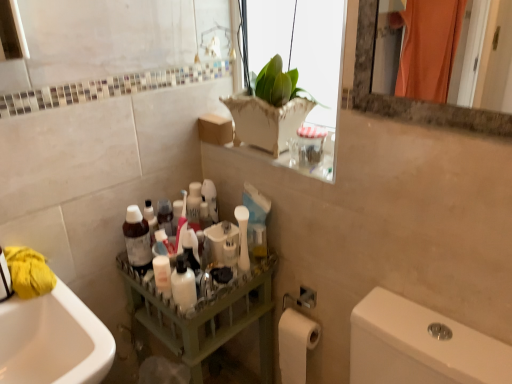
The image size is (512, 384). Find the location of `white glossy bottle at center`. white glossy bottle at center is located at coordinates (183, 284).

Measure the distance between point (239, 134) and camera.

Point (239, 134) is 1.35 meters from camera.

Image resolution: width=512 pixels, height=384 pixels. Describe the element at coordinates (293, 77) in the screenshot. I see `white ceramic vase at upper center` at that location.

What do you see at coordinates (295, 344) in the screenshot? The width and height of the screenshot is (512, 384). I see `white matte toilet paper at lower right` at bounding box center [295, 344].

Identify the location of white matte toilet paper at lower right. The image size is (512, 384). (295, 344).

Where is `white matte toothbrush at center`? The height and width of the screenshot is (384, 512). white matte toothbrush at center is located at coordinates (243, 237).

What is the approximate height of white matte toothbrush at center?

It is 20.59 centimeters.

This screenshot has width=512, height=384. What are the coordinates of `matte plastic bottle at center` in the screenshot? It's located at (x=137, y=240).

Considering the sizes of objects white glossy bottle at center and yellow fabric at left in the image provided, who is smaller, white glossy bottle at center or yellow fabric at left?

With smaller size is white glossy bottle at center.

Is white glossy bottle at center positioned with its back to yellow fabric at left?

white glossy bottle at center does not have its back to yellow fabric at left.

Is the position of white glossy bottle at center less distant than that of yellow fabric at left?

No, it is behind yellow fabric at left.

From the picture: In the image, is yellow fabric at left on the left side or the right side of matte plastic bottle at center?

Based on their positions, yellow fabric at left is located to the left of matte plastic bottle at center.

Would you say yellow fabric at left is a long distance from matte plastic bottle at center?

No, yellow fabric at left is not far from matte plastic bottle at center.

In the scene shown: Is yellow fabric at left oriented away from matte plastic bottle at center?

No, yellow fabric at left's orientation is not away from matte plastic bottle at center.

Looking at their sizes, would you say yellow fabric at left is wider or thinner than matte plastic bottle at center?

In the image, yellow fabric at left appears to be wider than matte plastic bottle at center.

Choose the correct answer: Is white matte toothbrush at center inside yellow fabric at left or outside it?

white matte toothbrush at center cannot be found inside yellow fabric at left.

Which is further, (x=238, y=209) or (x=14, y=276)?

The point (x=238, y=209) is farther from the camera.

Could you tell me if white matte toothbrush at center is facing yellow fabric at left?

Yes, white matte toothbrush at center is aimed at yellow fabric at left.

Is matte plastic bottle at center with white glossy bottle at center?

No.

Can you tell me how much matte plastic bottle at center and white glossy bottle at center differ in facing direction?

There is a 91.6-degree angle between the facing directions of matte plastic bottle at center and white glossy bottle at center.

Can you confirm if matte plastic bottle at center is thinner than white glossy bottle at center?

In fact, matte plastic bottle at center might be wider than white glossy bottle at center.

Between matte plastic bottle at center and white glossy bottle at center, which one appears on the left side from the viewer's perspective?

From the viewer's perspective, matte plastic bottle at center appears more on the left side.

Can you tell me how much white matte toothbrush at center and matte plastic bottle at center differ in facing direction?

127 degrees.

Based on the photo, is white matte toothbrush at center oriented away from matte plastic bottle at center?

No, white matte toothbrush at center is not facing the opposite direction of matte plastic bottle at center.

From the picture: Is white matte toothbrush at center thinner than matte plastic bottle at center?

Indeed, white matte toothbrush at center has a lesser width compared to matte plastic bottle at center.

Which is more to the right, white matte toothbrush at center or matte plastic bottle at center?

white matte toothbrush at center is more to the right.

From the image's perspective, is matte plastic bottle at center above or below yellow fabric at left?

Based on their image positions, matte plastic bottle at center is located above yellow fabric at left.

In the image, is matte plastic bottle at center on the left side or the right side of yellow fabric at left?

matte plastic bottle at center is positioned on yellow fabric at left's right side.

From a real-world perspective, which is physically below, matte plastic bottle at center or yellow fabric at left?

From a 3D spatial view, matte plastic bottle at center is below.

Is white ceramic vase at upper center wider or thinner than matte plastic bottle at center?

In the image, white ceramic vase at upper center appears to be wider than matte plastic bottle at center.

How different are the orientations of white ceramic vase at upper center and matte plastic bottle at center in degrees?

89.8 degrees separate the facing orientations of white ceramic vase at upper center and matte plastic bottle at center.

In the image, there is a white ceramic vase at upper center. What are the coordinates of `bottle below it (from a real-world perspective)` in the screenshot? It's located at (137, 240).

Considering the relative sizes of white ceramic vase at upper center and matte plastic bottle at center in the image provided, is white ceramic vase at upper center bigger than matte plastic bottle at center?

Yes, white ceramic vase at upper center is bigger than matte plastic bottle at center.

The width and height of the screenshot is (512, 384). What are the coordinates of `material above the white glossy bottle at center (from the image's perspective)` in the screenshot? It's located at (29, 272).

Locate an element on the screen. This screenshot has height=384, width=512. bottle on the right of yellow fabric at left is located at coordinates (137, 240).

Consider the image. Which object lies further to the anchor point white glossy bottle at center, matte plastic bottle at center or white matte toothbrush at center?

Among the two, white matte toothbrush at center is located further to white glossy bottle at center.

In the scene shown: When comparing their distances from white matte toilet paper at lower right, does white glossy bottle at center or yellow fabric at left seem further?

yellow fabric at left is further to white matte toilet paper at lower right.

Which object lies further to the anchor point yellow fabric at left, white matte toothbrush at center or white matte toilet paper at lower right?

white matte toilet paper at lower right lies further to yellow fabric at left than the other object.

When comparing their distances from white matte toothbrush at center, does matte plastic bottle at center or white ceramic vase at upper center seem further?

white ceramic vase at upper center.

Which object lies further to the anchor point white matte toilet paper at lower right, matte green tray at center or white matte toothbrush at center?

Among the two, white matte toothbrush at center is located further to white matte toilet paper at lower right.

When comparing their distances from white glossy bottle at center, does white matte toothbrush at center or matte plastic bottle at center seem further?

Among the two, white matte toothbrush at center is located further to white glossy bottle at center.

Looking at the image, which one is located closer to matte plastic bottle at center, white matte toilet paper at lower right or white ceramic vase at upper center?

white matte toilet paper at lower right.

From the image, which object appears to be nearer to matte plastic bottle at center, matte green tray at center or white glossy bottle at center?

The object closer to matte plastic bottle at center is white glossy bottle at center.

In order to click on toiletry that lies between white ceramic vase at upper center and matte green tray at center from top to bottom in this screenshot , I will do click(243, 237).

Identify the location of mouthwash between white ceramic vase at upper center and white matte toilet paper at lower right in the up-down direction. The height and width of the screenshot is (384, 512). (183, 284).

Identify the location of toiletry between matte plastic bottle at center and white matte toilet paper at lower right. This screenshot has height=384, width=512. (243, 237).

Identify the location of toiletry between white ceramic vase at upper center and white glossy bottle at center from top to bottom. This screenshot has height=384, width=512. (243, 237).